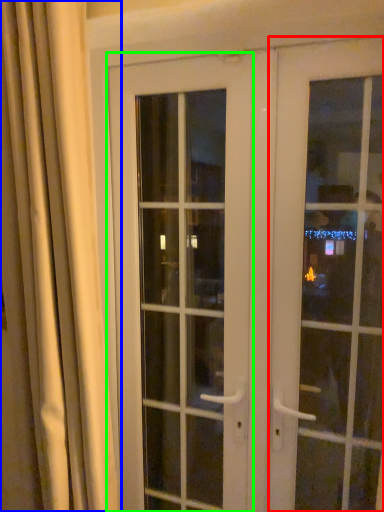
Question: Which object is the closest to the door (highlighted by a red box)? Choose among these: curtain (highlighted by a blue box) or door (highlighted by a green box).

Choices:
 (A) curtain
 (B) door

Answer: (B)